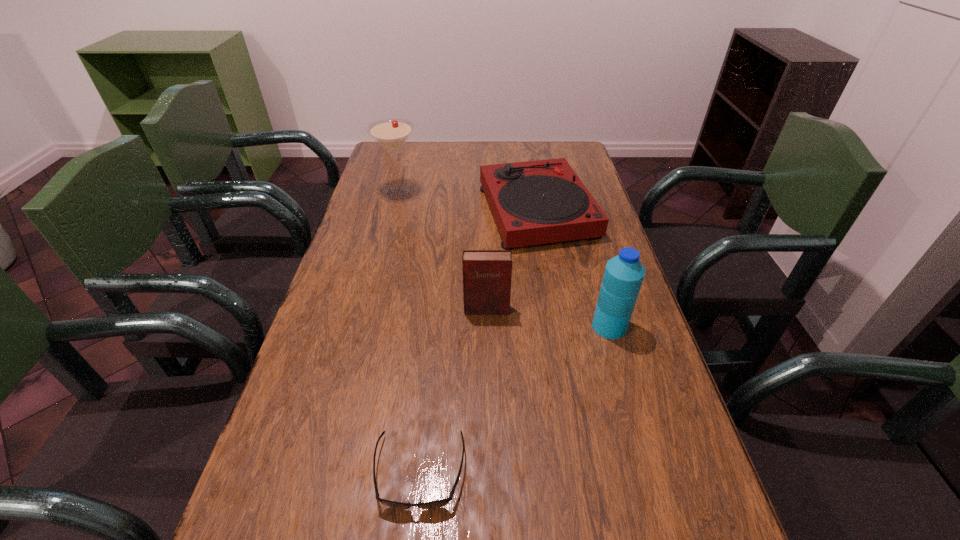
Where is `free space that satisfies the following two spatial constraints: 1. on the front cover of the water bottle; 2. on the left side of the diary`? This screenshot has height=540, width=960. free space that satisfies the following two spatial constraints: 1. on the front cover of the water bottle; 2. on the left side of the diary is located at coordinates (487, 326).